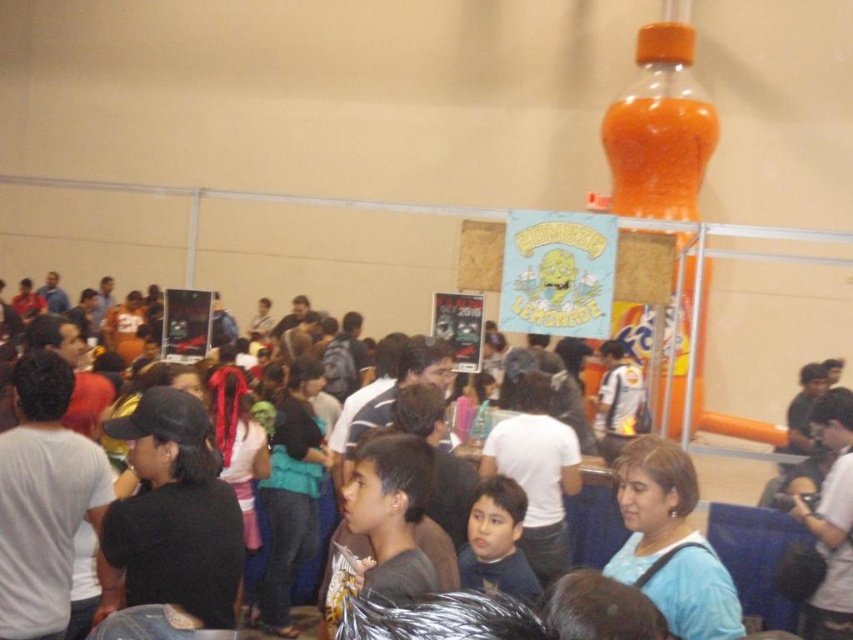
Who is higher up, matte black shirt at center or dark blue shirt at center?

Positioned higher is dark blue shirt at center.

Where is `matte black shirt at center`? Image resolution: width=853 pixels, height=640 pixels. matte black shirt at center is located at coordinates (593, 520).

Is point (602, 499) positioned in front of point (476, 490)?

No, it is not.

The image size is (853, 640). Identify the location of matte black shirt at center. (593, 520).